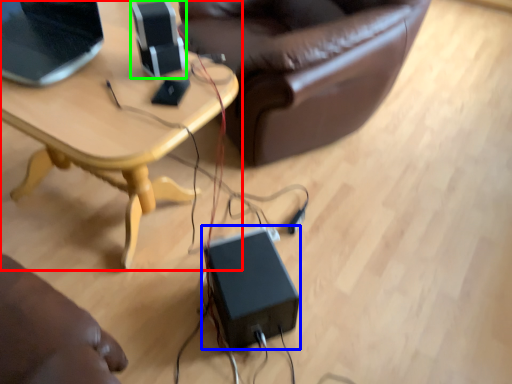
Question: Considering the real-world distances, which object is farthest from table (highlighted by a red box)? speaker (highlighted by a blue box) or speaker (highlighted by a green box)?

Choices:
 (A) speaker
 (B) speaker

Answer: (A)